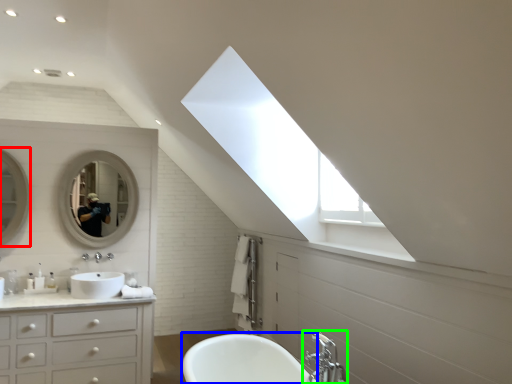
Question: Which object is positioned farthest from mirror (highlighted by a red box)? Select from bath (highlighted by a blue box) and tap (highlighted by a green box).

Choices:
 (A) bath
 (B) tap

Answer: (B)